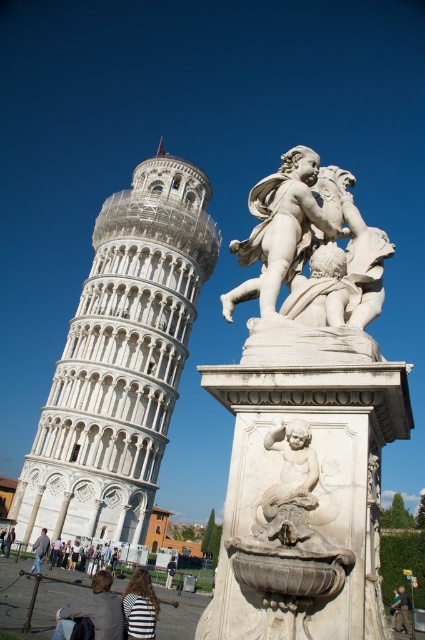
Does light brown hair at lower left appear on the right side of dark gray fabric jacket at lower right?

Incorrect, light brown hair at lower left is not on the right side of dark gray fabric jacket at lower right.

Is point (59, 620) closer to camera compared to point (396, 625)?

Yes, it is in front of point (396, 625).

Find the location of a particular element. This screenshot has width=425, height=640. light brown hair at lower left is located at coordinates (93, 611).

Who is shorter, white marble tower at left or white marble cherub at center?

white marble cherub at center

Does white marble tower at left come in front of white marble cherub at center?

No.

Which is behind, point (147, 355) or point (292, 440)?

Point (147, 355)

Where is `white marble tower at left`? white marble tower at left is located at coordinates (121, 360).

Who is shorter, white marble statue at right or dark gray fabric jacket at lower right?

With less height is dark gray fabric jacket at lower right.

Is white marble statue at right shorter than dark gray fabric jacket at lower right?

No.

From the picture: Who is more distant from viewer, (x=221, y=301) or (x=402, y=625)?

The point (x=221, y=301) is more distant.

The width and height of the screenshot is (425, 640). I want to click on white marble statue at right, so click(309, 248).